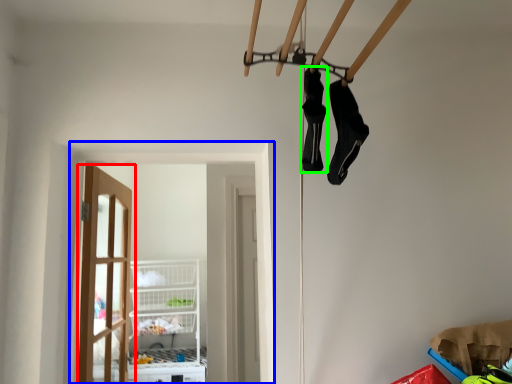
Question: Which is nearer to the door (highlighted by a red box)? window (highlighted by a blue box) or footwear (highlighted by a green box).

Choices:
 (A) window
 (B) footwear

Answer: (A)